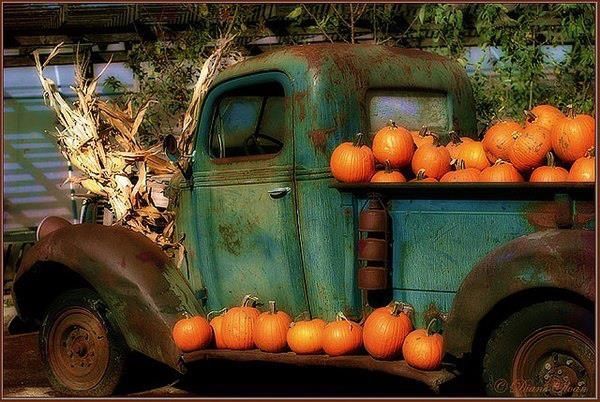
Image resolution: width=600 pixels, height=402 pixels. I want to click on door, so click(x=236, y=222).